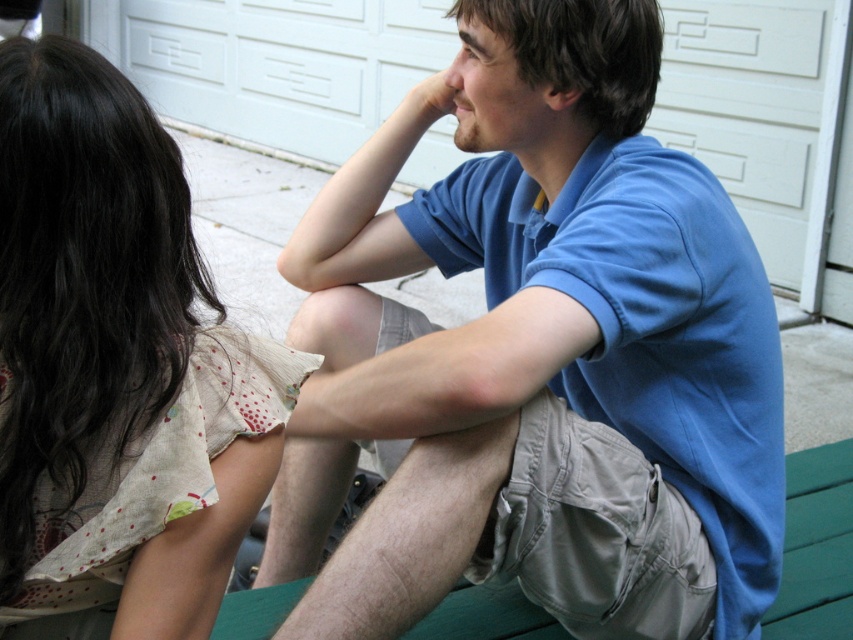
Question: Estimate the real-world distances between objects in this image. Which object is closer to the blue cotton shirt at center?

Choices:
 (A) matte skin hand at upper center
 (B) floral cotton blouse at upper left
 (C) white textured garage door at upper center

Answer: (B)

Question: Can you confirm if white textured garage door at upper center is wider than matte skin hand at upper center?

Choices:
 (A) no
 (B) yes

Answer: (B)

Question: Estimate the real-world distances between objects in this image. Which object is farther from the white textured garage door at upper center?

Choices:
 (A) matte skin hand at upper center
 (B) floral cotton blouse at upper left

Answer: (B)

Question: Can you confirm if blue cotton shirt at center is positioned to the right of white textured garage door at upper center?

Choices:
 (A) no
 (B) yes

Answer: (B)

Question: Is blue cotton shirt at center smaller than floral cotton blouse at upper left?

Choices:
 (A) yes
 (B) no

Answer: (B)

Question: Which object appears closest to the camera in this image?

Choices:
 (A) floral cotton blouse at upper left
 (B) white textured garage door at upper center

Answer: (A)